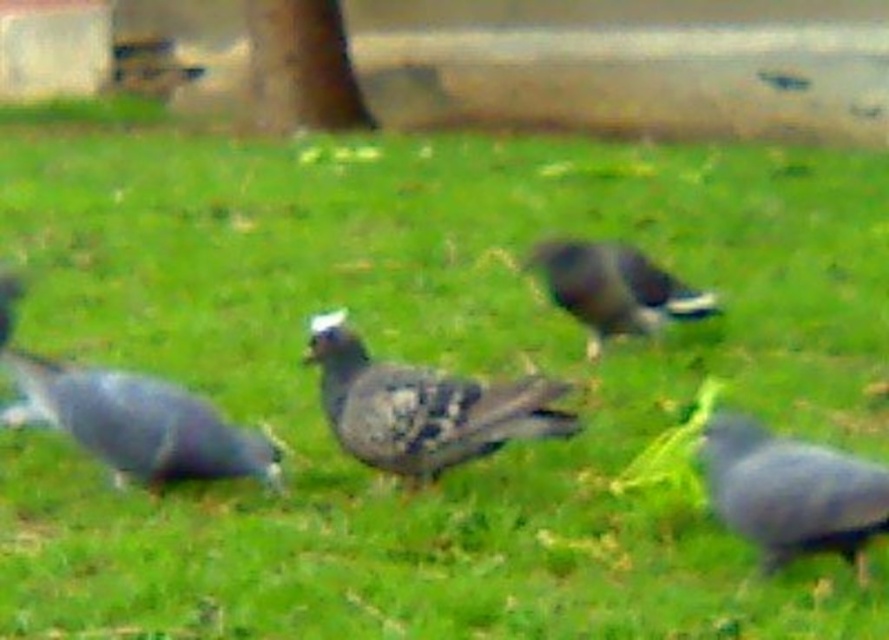
Describe the element at coordinates (135, 422) in the screenshot. The height and width of the screenshot is (640, 889). I see `matte gray pigeon at center` at that location.

Which is above, matte gray pigeon at center or gray matte pigeon at lower right?

matte gray pigeon at center

The height and width of the screenshot is (640, 889). What do you see at coordinates (135, 422) in the screenshot?
I see `matte gray pigeon at center` at bounding box center [135, 422].

I want to click on matte gray pigeon at center, so click(135, 422).

Between point (799, 476) and point (594, 250), which one is positioned behind?

The point (594, 250) is behind.

Does gray matte pigeon at lower right come behind gray matte bird at center?

No, gray matte pigeon at lower right is closer to the viewer.

Where is `gray matte pigeon at lower right`? gray matte pigeon at lower right is located at coordinates (791, 492).

Can you confirm if matte gray pigeon at center is thinner than gray matte bird at center?

No, matte gray pigeon at center is not thinner than gray matte bird at center.

Between matte gray pigeon at center and gray matte bird at center, which one has less height?

matte gray pigeon at center is shorter.

The height and width of the screenshot is (640, 889). I want to click on matte gray pigeon at center, so click(135, 422).